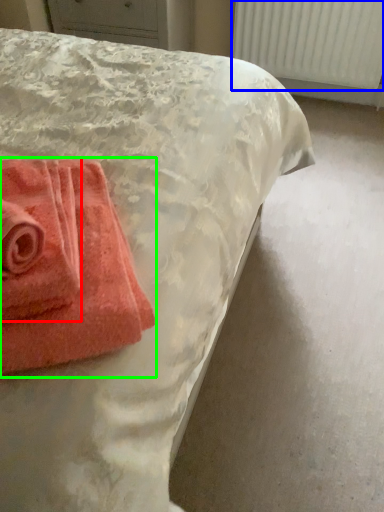
Question: Which object is the closest to the towel (highlighted by a red box)? Choose among these: radiator (highlighted by a blue box) or towel (highlighted by a green box).

Choices:
 (A) radiator
 (B) towel

Answer: (B)